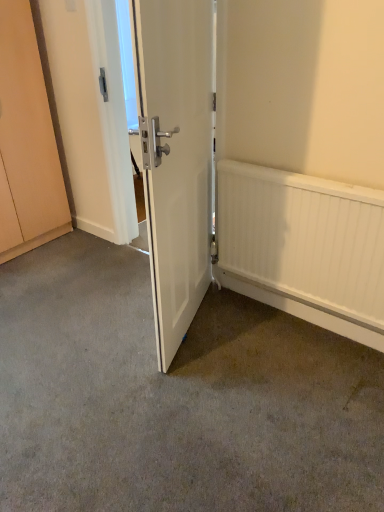
Question: Can you confirm if white matte door at center is bigger than matte wood cabinet at left?

Choices:
 (A) yes
 (B) no

Answer: (B)

Question: Is white matte door at center far from matte wood cabinet at left?

Choices:
 (A) no
 (B) yes

Answer: (B)

Question: Is matte wood cabinet at left inside white matte door at center?

Choices:
 (A) yes
 (B) no

Answer: (B)

Question: Is white matte door at center positioned in front of matte wood cabinet at left?

Choices:
 (A) yes
 (B) no

Answer: (A)

Question: From the image's perspective, would you say white matte door at center is positioned over matte wood cabinet at left?

Choices:
 (A) no
 (B) yes

Answer: (A)

Question: In terms of size, does gray carpet at center appear bigger or smaller than white matte door at center?

Choices:
 (A) small
 (B) big

Answer: (B)

Question: Would you say gray carpet at center is to the left or to the right of white matte door at center in the picture?

Choices:
 (A) left
 (B) right

Answer: (A)

Question: Is gray carpet at center taller or shorter than white matte door at center?

Choices:
 (A) tall
 (B) short

Answer: (B)

Question: Is gray carpet at center in front of or behind white matte door at center in the image?

Choices:
 (A) front
 (B) behind

Answer: (A)

Question: Is white textured radiator at right in front of or behind matte wood cabinet at left in the image?

Choices:
 (A) behind
 (B) front

Answer: (B)

Question: Based on their sizes in the image, would you say white textured radiator at right is bigger or smaller than matte wood cabinet at left?

Choices:
 (A) big
 (B) small

Answer: (B)

Question: From the image's perspective, is white textured radiator at right above or below matte wood cabinet at left?

Choices:
 (A) above
 (B) below

Answer: (B)

Question: Considering the positions of point (304, 298) and point (56, 234), is point (304, 298) closer or farther from the camera than point (56, 234)?

Choices:
 (A) farther
 (B) closer

Answer: (B)

Question: Considering their positions, is white textured radiator at right located in front of or behind white matte door at center?

Choices:
 (A) front
 (B) behind

Answer: (B)

Question: In terms of size, does white textured radiator at right appear bigger or smaller than white matte door at center?

Choices:
 (A) big
 (B) small

Answer: (B)